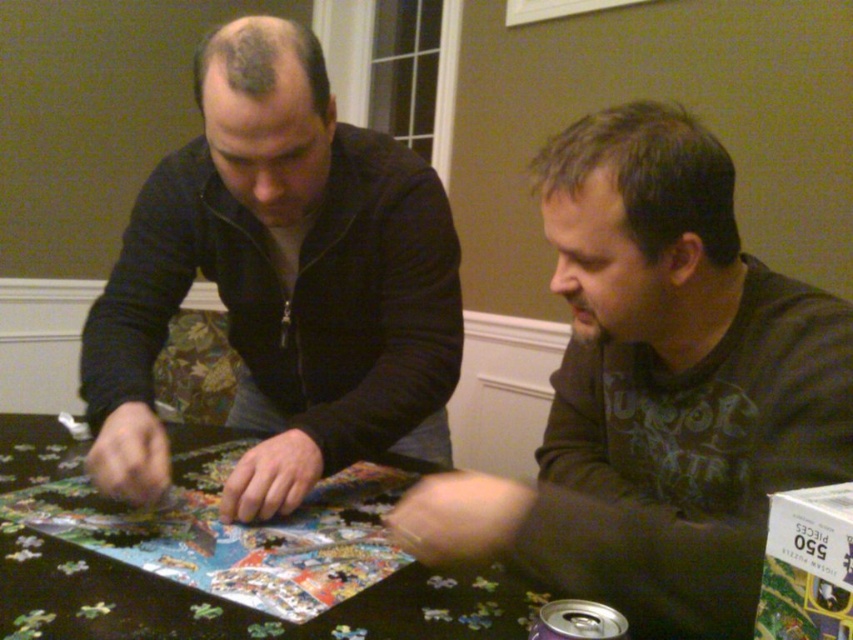
Who is more forward, [397,518] or [0,419]?

Point [397,518] is more forward.

I want to click on dark brown shirt at center, so click(x=657, y=390).

Is dark blue zip-up sweater at upper left below black puzzle pieces at center?

Incorrect, dark blue zip-up sweater at upper left is not positioned below black puzzle pieces at center.

The height and width of the screenshot is (640, 853). Describe the element at coordinates (281, 282) in the screenshot. I see `dark blue zip-up sweater at upper left` at that location.

Locate an element on the screen. dark blue zip-up sweater at upper left is located at coordinates (281, 282).

The image size is (853, 640). Identify the location of dark blue zip-up sweater at upper left. (281, 282).

Can you confirm if dark brown shirt at center is thinner than dark blue zip-up sweater at upper left?

Yes, dark brown shirt at center is thinner than dark blue zip-up sweater at upper left.

Based on the photo, which is below, dark brown shirt at center or dark blue zip-up sweater at upper left?

dark brown shirt at center

Between point (444, 525) and point (311, 38), which one is positioned behind?

Point (311, 38)

Locate an element on the screen. dark brown shirt at center is located at coordinates (657, 390).